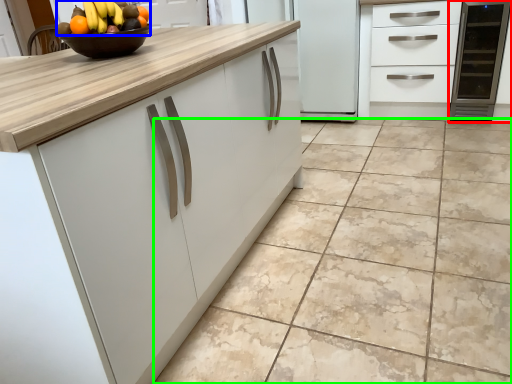
Question: Based on their relative distances, which object is farther from appliance (highlighted by a red box)? Choose from grapefruit (highlighted by a blue box) and ceramic tile (highlighted by a green box).

Choices:
 (A) grapefruit
 (B) ceramic tile

Answer: (A)